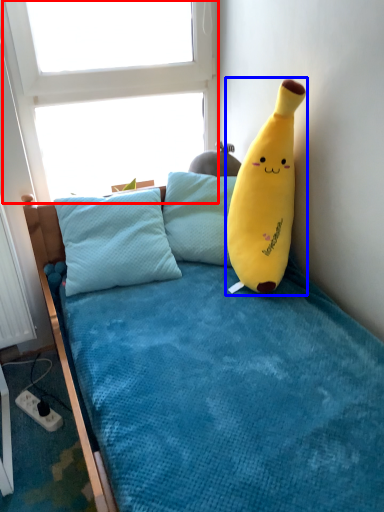
Question: Which object appears closest to the camera in this image, window screen (highlighted by a red box) or toy (highlighted by a blue box)?

Choices:
 (A) window screen
 (B) toy

Answer: (B)